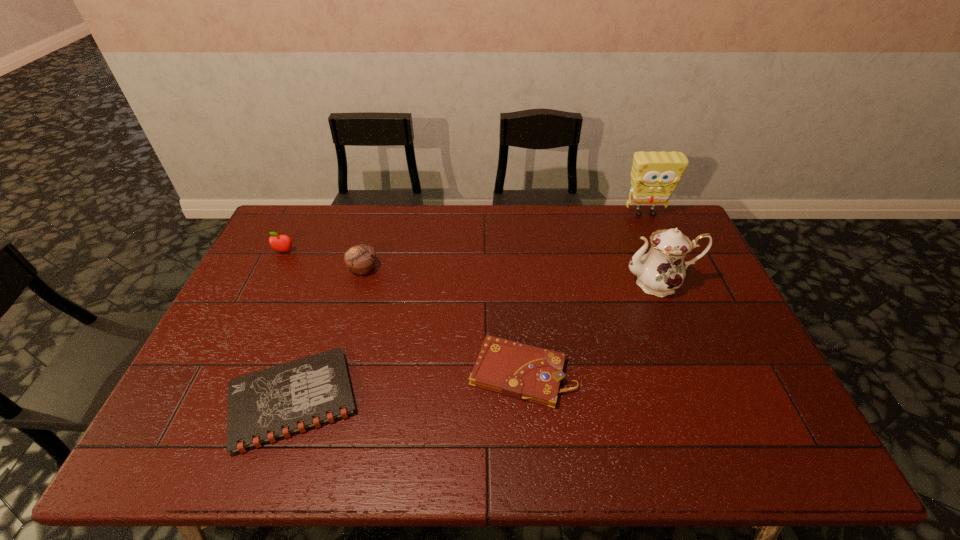
What are the coordinates of `vacant region that satisfies the following two spatial constraints: 1. on the back side of the shorter notebook; 2. on the left side of the right notebook` in the screenshot? It's located at point(303,373).

The image size is (960, 540). Identify the location of vacant space that satisfies the following two spatial constraints: 1. on the back side of the muffin; 2. on the right side of the shortest object. (338, 269).

Image resolution: width=960 pixels, height=540 pixels. What are the coordinates of `vacant region that satisfies the following two spatial constraints: 1. on the front side of the fifth nearest object; 2. on the right side of the shortest object` in the screenshot? It's located at click(212, 401).

Locate an element on the screen. free point that satisfies the following two spatial constraints: 1. on the front side of the muffin; 2. on the right side of the second farthest object is located at coordinates (276, 269).